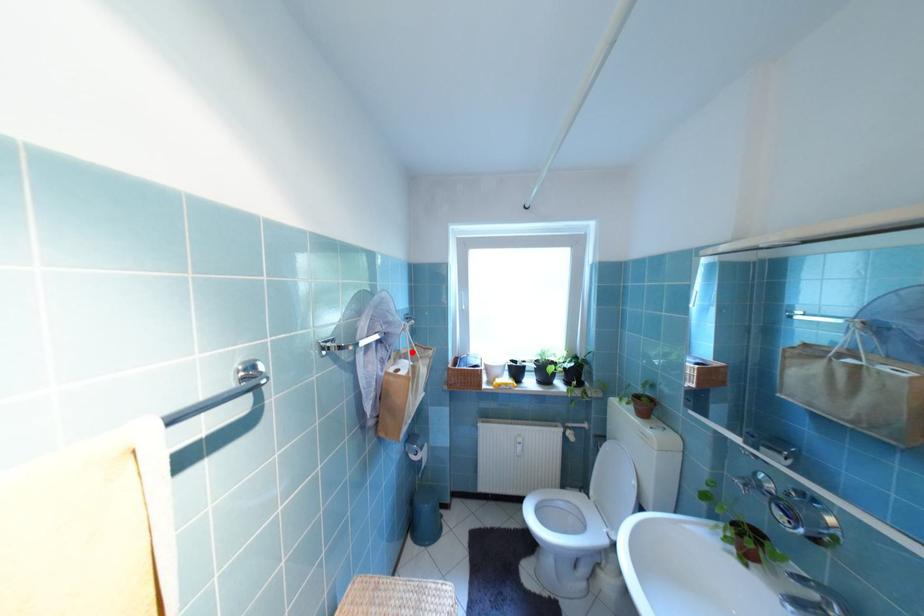
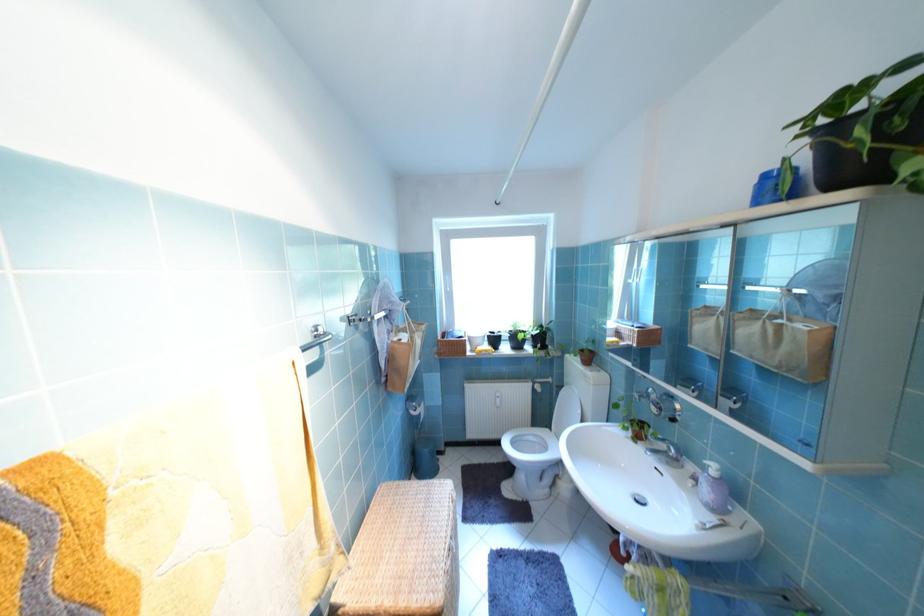
Find the pixel in the second image that matches the highlighted location in the first image.

(410, 326)